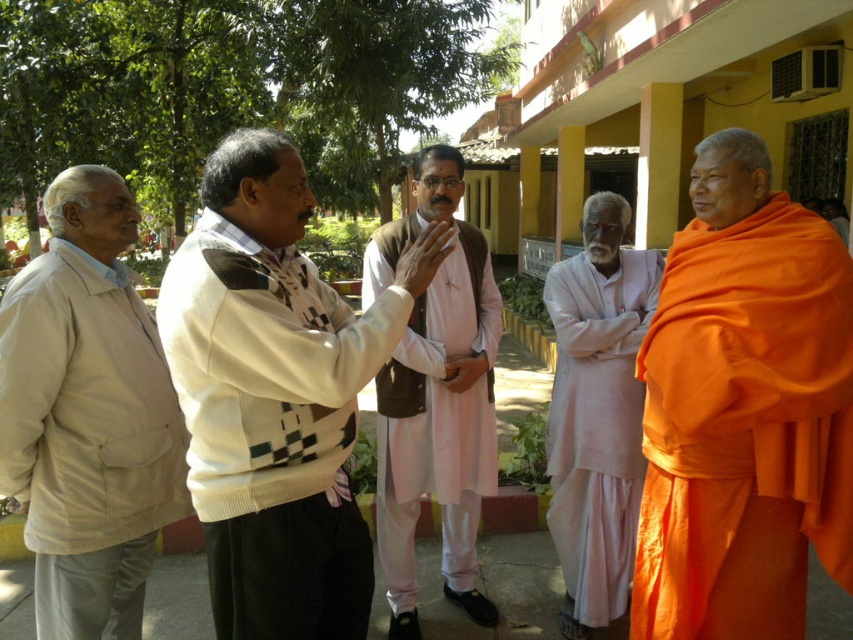
In the scene, there is a point marked at coordinates (746,428). Which object does this point correspond to?

The point at coordinates (746,428) corresponds to the orange cloth at right.